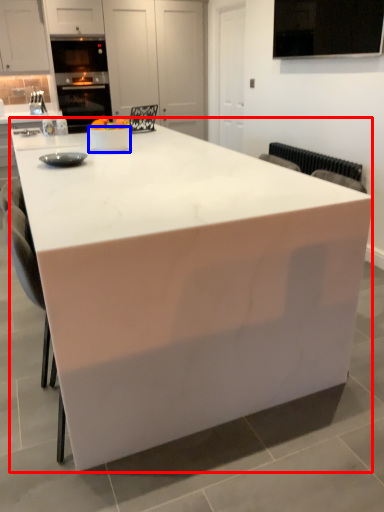
Question: Which of the following is the closest to the observer, table (highlighted by a red box) or bowl (highlighted by a blue box)?

Choices:
 (A) table
 (B) bowl

Answer: (A)